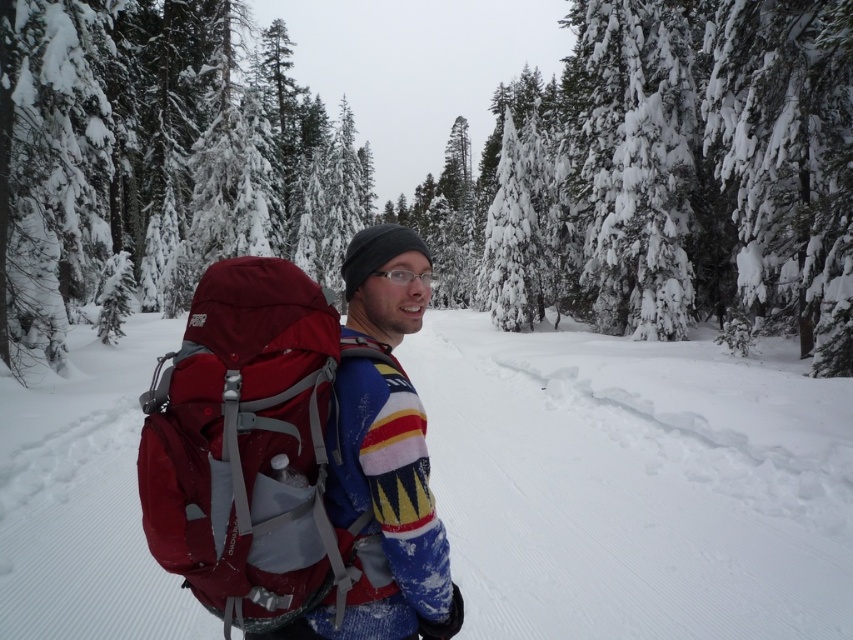
Question: Which is farther from the clear plastic glasses at center?

Choices:
 (A) matte red backpack at center
 (B) snowy evergreen tree at center

Answer: (B)

Question: Which of the following is the farthest from the observer?

Choices:
 (A) (109, 170)
 (B) (373, 272)
 (C) (128, 625)

Answer: (A)

Question: Does matte red backpack at center have a lesser width compared to clear plastic glasses at center?

Choices:
 (A) no
 (B) yes

Answer: (A)

Question: Among these points, which one is nearest to the camera?

Choices:
 (A) (274, 580)
 (B) (798, 550)

Answer: (A)

Question: Does snowy evergreen tree at center have a larger size compared to clear plastic glasses at center?

Choices:
 (A) yes
 (B) no

Answer: (A)

Question: Where is snowy evergreen tree at center located in relation to white fluffy snow at center in the image?

Choices:
 (A) right
 (B) left

Answer: (B)